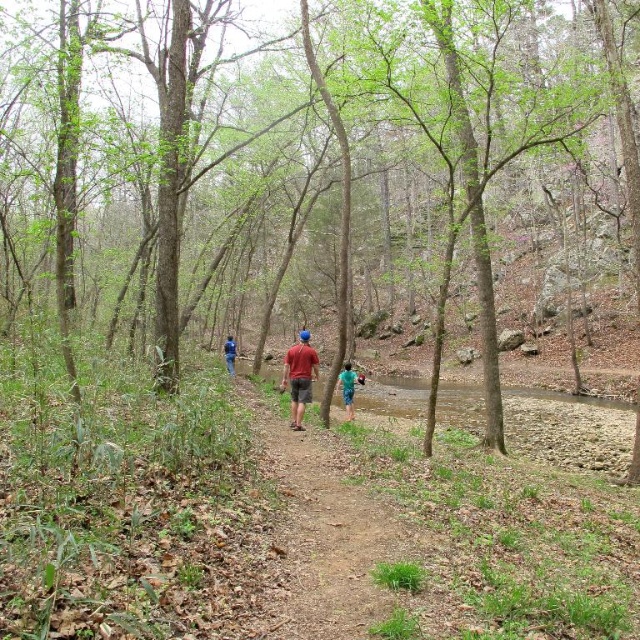
Question: Which is farther from the blue denim jeans at center?

Choices:
 (A) brown wood tree at center
 (B) matte red shirt at center
 (C) brown dirt path at center

Answer: (A)

Question: Is brown dirt path at center to the left of blue denim jeans at center from the viewer's perspective?

Choices:
 (A) yes
 (B) no

Answer: (B)

Question: Among these objects, which one is nearest to the camera?

Choices:
 (A) green fabric shorts at center
 (B) brown dirt path at center
 (C) blue denim jeans at center

Answer: (B)

Question: Can you confirm if brown wood tree at center is positioned to the left of matte red shirt at center?

Choices:
 (A) no
 (B) yes

Answer: (A)

Question: Which point is farther to the camera?

Choices:
 (A) (225, 346)
 (B) (285, 563)
 (C) (353, 385)

Answer: (A)

Question: Can you confirm if brown wood tree at center is wider than brown dirt path at center?

Choices:
 (A) no
 (B) yes

Answer: (B)